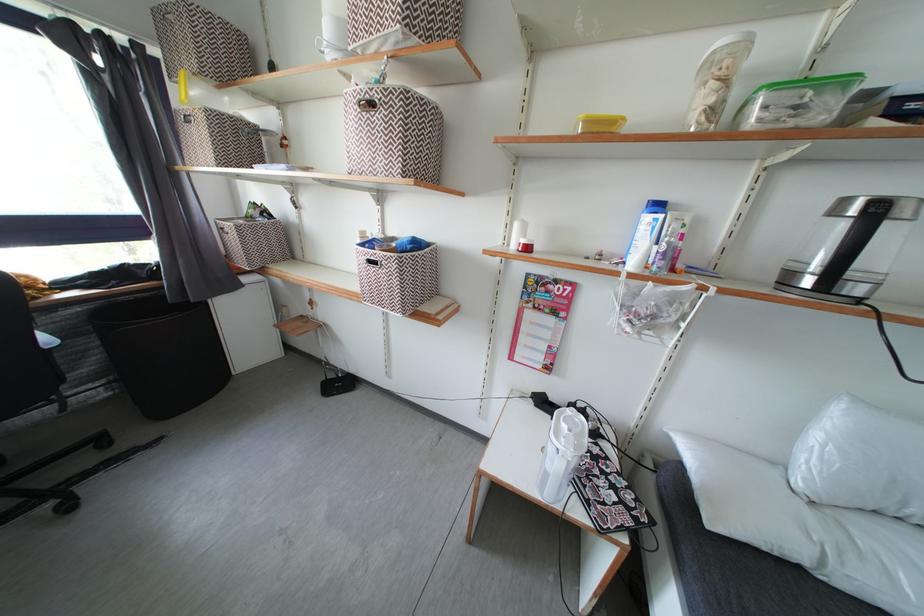
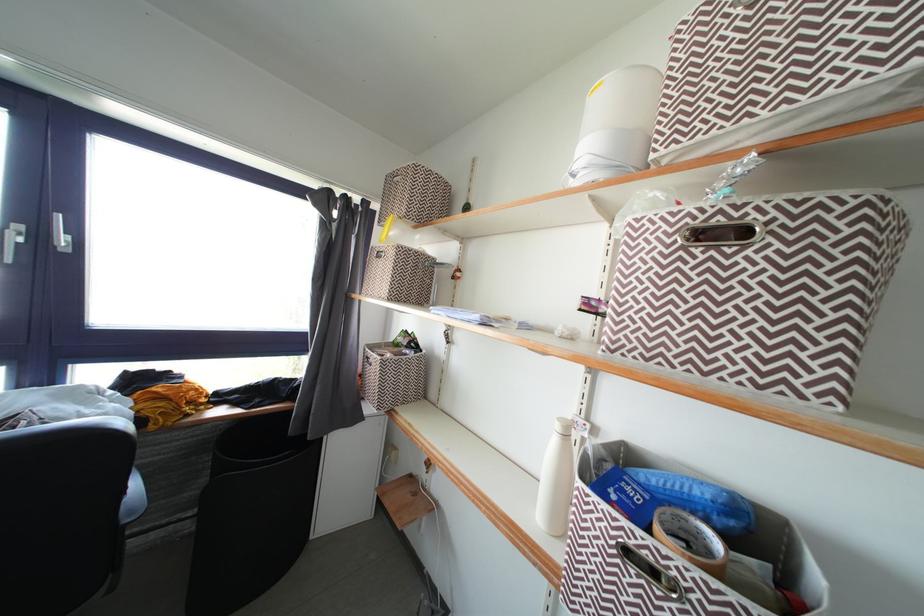
In the second image, find the point that corresponds to point (245, 233) in the first image.

(390, 367)